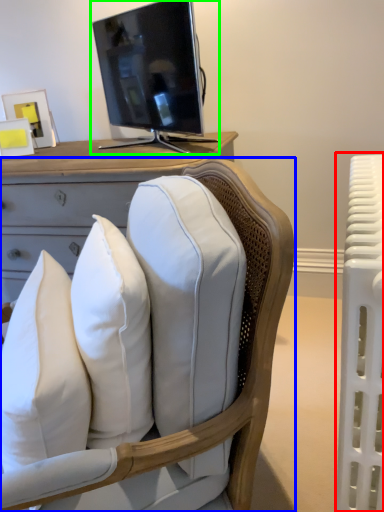
Question: Which object is positioned closest to radiator (highlighted by a red box)? Select from chair (highlighted by a blue box) and television (highlighted by a green box).

Choices:
 (A) chair
 (B) television

Answer: (A)